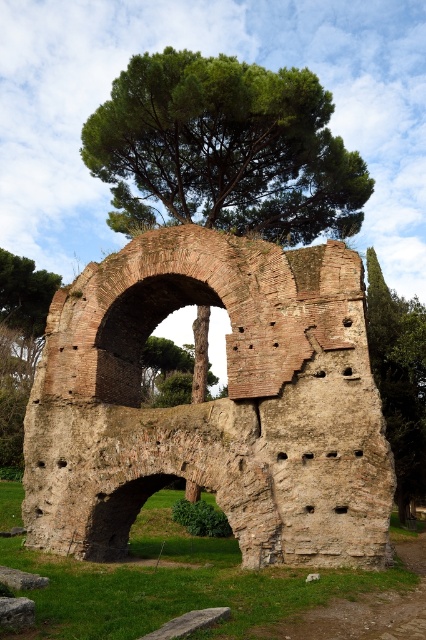
Who is taller, brick stone arch at center or green leafy tree at upper center?

brick stone arch at center

Which is in front, point (270, 404) or point (163, 60)?

Point (270, 404) is more forward.

Locate an element on the screen. The width and height of the screenshot is (426, 640). brick stone arch at center is located at coordinates (213, 403).